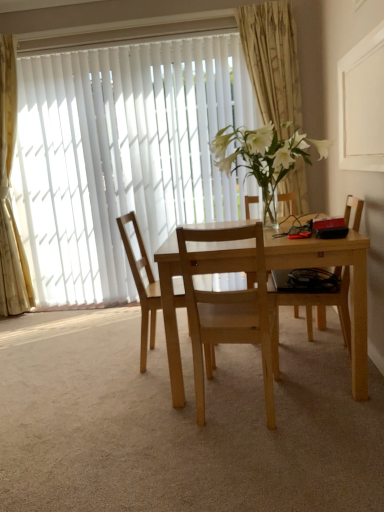
Locate an element on the screen. empty space that is to the right of white sheer curtain at left, the second curtain from the right is located at coordinates coord(67,313).